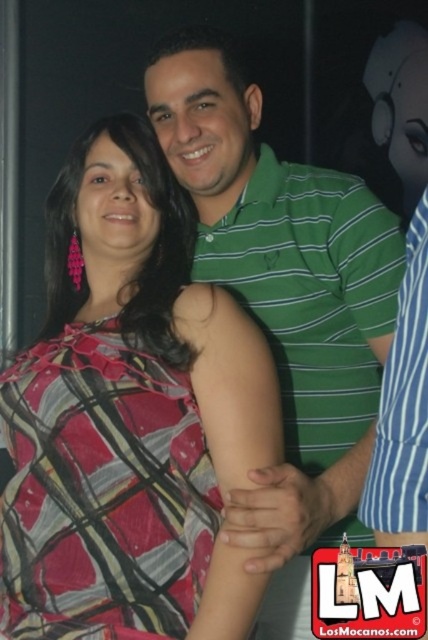
Question: Which point is closer to the camera taking this photo?

Choices:
 (A) (332, 536)
 (B) (139, 525)

Answer: (B)

Question: Can you confirm if green striped polo shirt at center is positioned below green striped shirt at right?

Choices:
 (A) no
 (B) yes

Answer: (A)

Question: Observing the image, what is the correct spatial positioning of plaid fabric dress at center in reference to green striped shirt at right?

Choices:
 (A) below
 (B) above

Answer: (B)

Question: Which of the following is the farthest from the observer?

Choices:
 (A) [x=385, y=371]
 (B) [x=303, y=516]

Answer: (B)

Question: Which of these objects is positioned farthest from the green striped shirt at right?

Choices:
 (A) plaid fabric dress at center
 (B) green striped polo shirt at center

Answer: (A)

Question: Is green striped polo shirt at center positioned before green striped shirt at right?

Choices:
 (A) yes
 (B) no

Answer: (B)